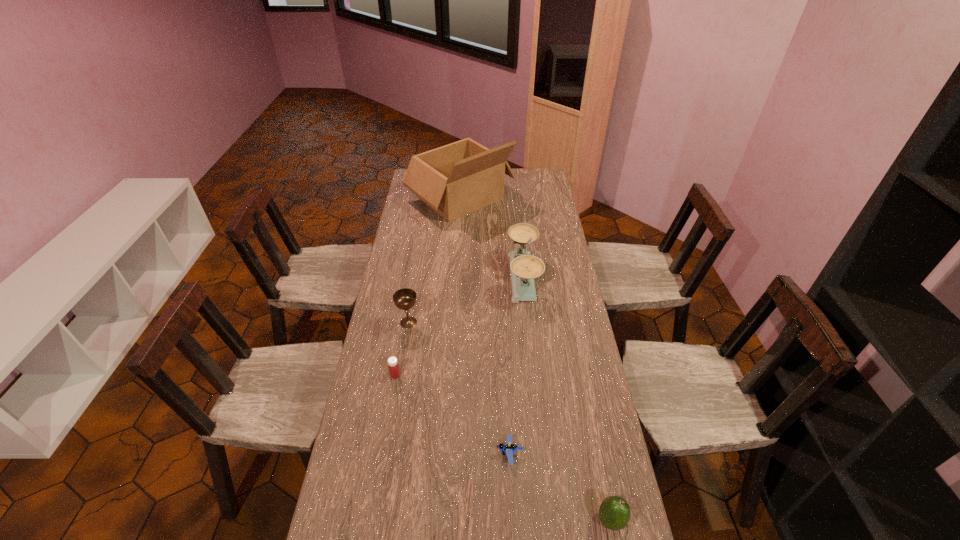
At what (x,y) coordinates should I click in order to perform the action: click on the fifth farthest object. Please return your answer as a coordinate pair (x, y). Looking at the image, I should click on (509, 448).

Image resolution: width=960 pixels, height=540 pixels. I want to click on Lego, so click(509, 448).

The width and height of the screenshot is (960, 540). Find the location of `free space located on the right of the box`. free space located on the right of the box is located at coordinates (530, 198).

Where is `vacant space located on the front-facing side of the second tallest object`? This screenshot has height=540, width=960. vacant space located on the front-facing side of the second tallest object is located at coordinates (417, 278).

Locate an element on the screen. The height and width of the screenshot is (540, 960). free space located on the front-facing side of the second tallest object is located at coordinates 476,278.

Identify the location of vacant space positioned on the front-facing side of the second tallest object. This screenshot has height=540, width=960. (417, 278).

Find the location of a particular element. This screenshot has width=960, height=540. free space located 0.220m on the front of the third farthest object is located at coordinates (399, 381).

Identify the location of free region located 0.280m on the left of the avocado. (490, 520).

I want to click on blank space located on the back of the medicine, so click(409, 297).

In order to click on vacant space located 0.140m on the front-facing side of the shortest object in this screenshot , I will do `click(449, 454)`.